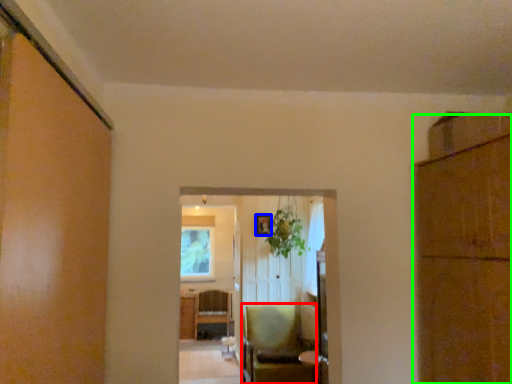
Question: Based on their relative distances, which object is farther from chair (highlighted by a red box)? Choose from picture frame (highlighted by a blue box) and cabinetry (highlighted by a green box).

Choices:
 (A) picture frame
 (B) cabinetry

Answer: (B)